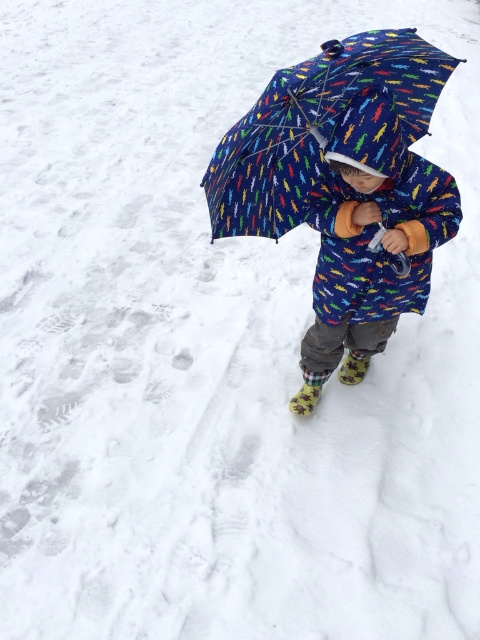
You are a photographer trying to capture the child holding an umbrella in the snow. The scene requires the umbrella to be large enough to cover the child completely. Given that the child is 1.2 meters tall, can the printed fabric umbrella at center and the blue fabric umbrella at center both cover the child adequately?

The printed fabric umbrella at center is larger in size than blue fabric umbrella at center. Since the child is 1.2 meters tall, the printed fabric umbrella at center is likely large enough to cover the child completely, but the blue fabric umbrella at center may be too small.